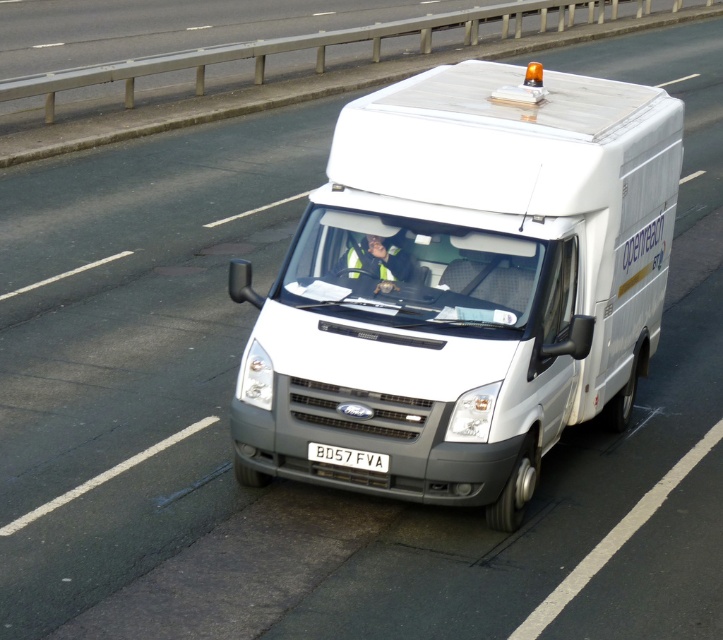
Which of these two, white matte van at center or white plastic license plate at center, stands taller?

white matte van at center is taller.

Where is `white matte van at center`? white matte van at center is located at coordinates coord(463,284).

Identify the location of white matte van at center. pyautogui.click(x=463, y=284).